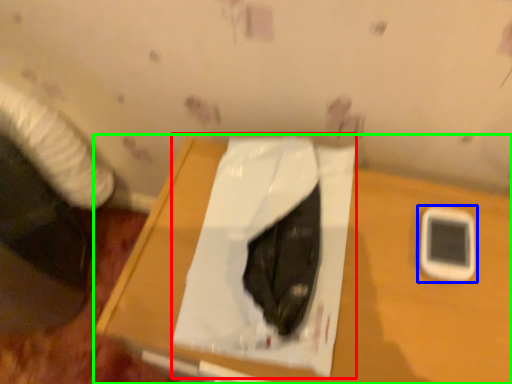
Question: Estimate the real-world distances between objects in this image. Which object is farther from sheet (highlighted by a red box), mobile phone (highlighted by a blue box) or table (highlighted by a green box)?

Choices:
 (A) mobile phone
 (B) table

Answer: (A)